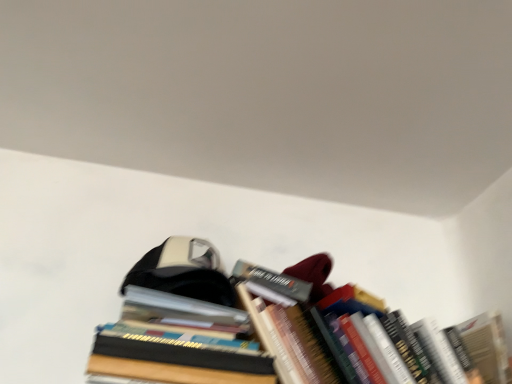
Question: From a real-world perspective, is hardcover books at center, positioned as the first book in left-to-right order, physically located above or below hardcover books at upper right, positioned as the first book in right-to-left order?

Choices:
 (A) below
 (B) above

Answer: (A)

Question: Considering the positions of hardcover books at center, positioned as the first book in left-to-right order, and hardcover books at upper right, the second book from the left, in the image, is hardcover books at center, positioned as the first book in left-to-right order, wider or thinner than hardcover books at upper right, the second book from the left,?

Choices:
 (A) wide
 (B) thin

Answer: (B)

Question: Would you say hardcover books at center, positioned as the first book in left-to-right order, is to the left or to the right of hardcover books at upper right, the second book from the left, in the picture?

Choices:
 (A) right
 (B) left

Answer: (B)

Question: Is hardcover books at upper right, the second book from the left, wider or thinner than hardcover books at center, positioned as the first book in left-to-right order?

Choices:
 (A) thin
 (B) wide

Answer: (B)

Question: Based on their sizes in the image, would you say hardcover books at upper right, positioned as the first book in right-to-left order, is bigger or smaller than hardcover books at center, positioned as the first book in left-to-right order?

Choices:
 (A) big
 (B) small

Answer: (A)

Question: Choose the correct answer: Is hardcover books at upper right, positioned as the first book in right-to-left order, inside hardcover books at center, positioned as the first book in left-to-right order, or outside it?

Choices:
 (A) outside
 (B) inside

Answer: (A)

Question: Considering the relative positions of hardcover books at upper right, the second book from the left, and hardcover books at center, positioned as the first book in left-to-right order, in the image provided, is hardcover books at upper right, the second book from the left, to the left or to the right of hardcover books at center, positioned as the first book in left-to-right order,?

Choices:
 (A) left
 (B) right

Answer: (B)